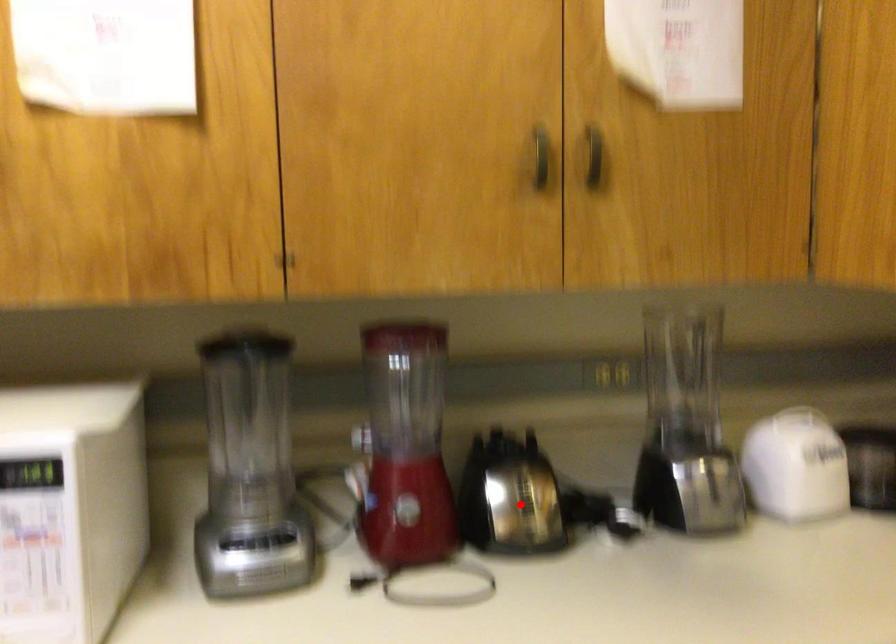
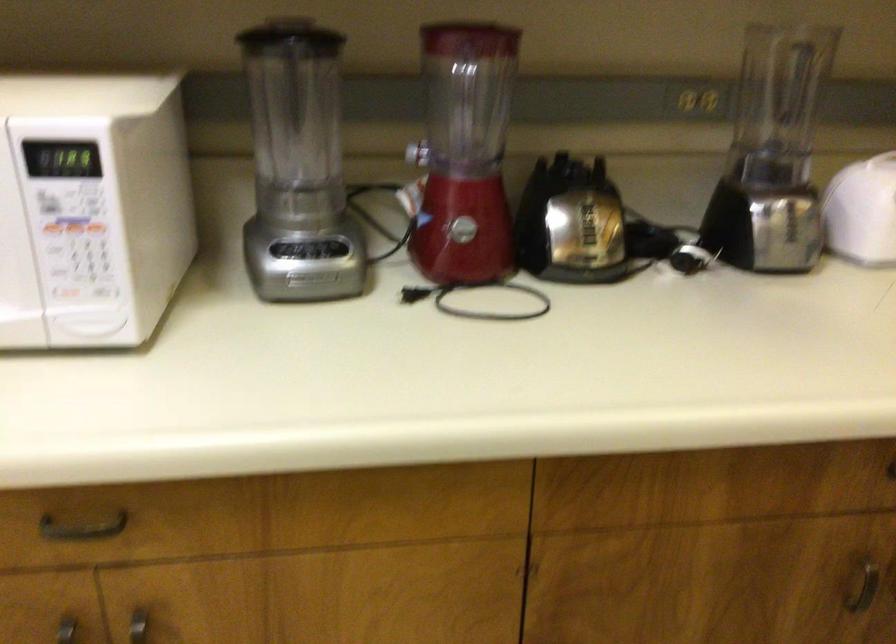
Locate, in the second image, the point that corresponds to the highlighted location in the first image.

(580, 225)